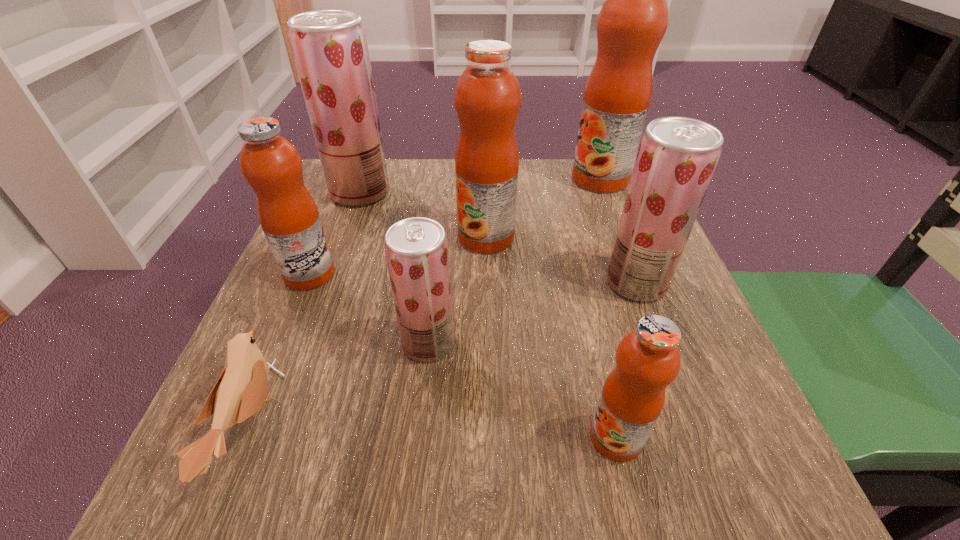
I want to click on free space located on the front label of the sixth nearest object, so click(x=406, y=237).

I want to click on vacant space located 0.200m on the front label of the sixth nearest object, so click(x=363, y=237).

Locate an element on the screen. The width and height of the screenshot is (960, 540). vacant region located 0.120m on the back of the second biggest strawberry fruit juice is located at coordinates (615, 226).

The height and width of the screenshot is (540, 960). I want to click on free space located on the front label of the leftmost orange fruit juice, so click(361, 274).

I want to click on blank space located on the back of the second strawberry fruit juice from left to right, so click(437, 262).

Image resolution: width=960 pixels, height=540 pixels. Find the location of `vacant space located on the front label of the fifth fruit juice from left to right`. vacant space located on the front label of the fifth fruit juice from left to right is located at coordinates (495, 437).

The height and width of the screenshot is (540, 960). I want to click on vacant space situated 0.350m on the front label of the fifth fruit juice from left to right, so click(x=335, y=437).

The width and height of the screenshot is (960, 540). I want to click on free space located 0.100m on the front label of the fifth fruit juice from left to right, so click(x=516, y=437).

Image resolution: width=960 pixels, height=540 pixels. In order to click on free space located at the beak of the shortest object in this screenshot , I will do `click(351, 426)`.

Locate an element on the screen. fruit juice that is at the near edge is located at coordinates (648, 359).